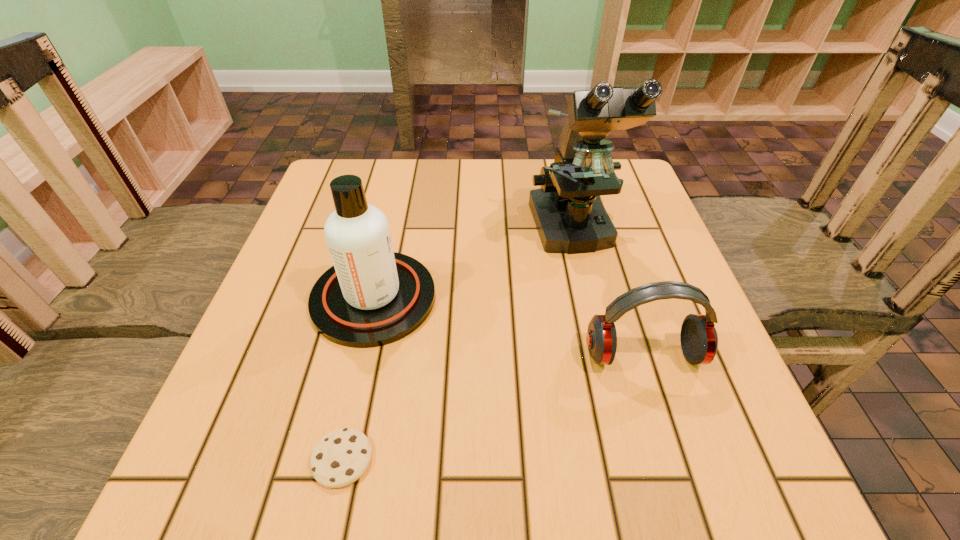
The image size is (960, 540). I want to click on vacant region at the near right corner of the desktop, so click(x=762, y=481).

Find the location of `empty location between the microscope and the earphone`. empty location between the microscope and the earphone is located at coordinates (x=608, y=293).

Locate an element on the screen. This screenshot has width=960, height=540. vacant space in between the cleansing agent and the earphone is located at coordinates (509, 326).

The image size is (960, 540). I want to click on free space between the cookie and the tallest object, so click(457, 345).

At what (x,y) coordinates should I click in order to perform the action: click on unoccupied position between the earphone and the third shortest object. Please return your answer as a coordinate pair (x, y). This screenshot has width=960, height=540. Looking at the image, I should click on (509, 326).

Identify the location of free space between the microscope and the shortest object. (457, 345).

At what (x,y) coordinates should I click in order to perform the action: click on unoccupied position between the nearest object and the second shortest object. Please return your answer as a coordinate pair (x, y). Image resolution: width=960 pixels, height=540 pixels. Looking at the image, I should click on pyautogui.click(x=492, y=407).

Find the location of a particular element. free space between the nearest object and the tallest object is located at coordinates (457, 345).

At what (x,y) coordinates should I click in order to perform the action: click on free spot between the second shortest object and the microscope. Please return your answer as a coordinate pair (x, y). This screenshot has height=540, width=960. Looking at the image, I should click on (608, 293).

Where is `vacant area that lies between the third tallest object and the shortest object`? This screenshot has height=540, width=960. vacant area that lies between the third tallest object and the shortest object is located at coordinates (492, 407).